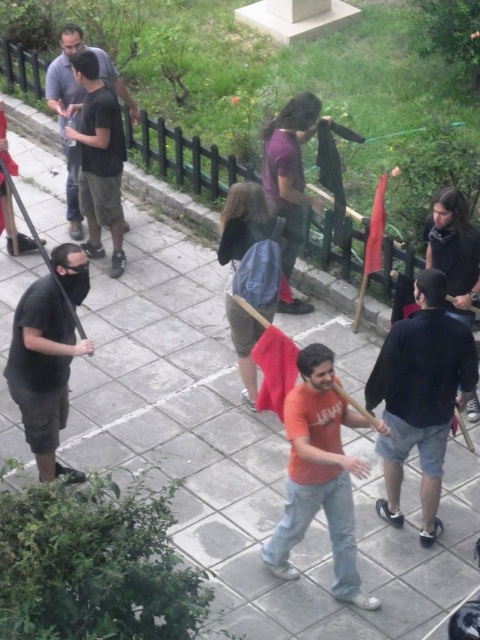
Question: Which of the following is the farthest from the observer?

Choices:
 (A) black matte t-shirt at left
 (B) purple matte shirt at center

Answer: (B)

Question: Is black matte t-shirt at left closer to camera compared to denim shorts at center?

Choices:
 (A) yes
 (B) no

Answer: (A)

Question: Is orange t-shirt at center below denim shorts at center?

Choices:
 (A) yes
 (B) no

Answer: (A)

Question: Estimate the real-world distances between objects in this image. Which object is farther from the dark gray shirt at upper left?

Choices:
 (A) denim shorts at center
 (B) orange t-shirt at center
 (C) purple matte shirt at center
 (D) black matte t-shirt at left

Answer: (B)

Question: Which of the following is the farthest from the observer?

Choices:
 (A) (73, 182)
 (B) (266, 170)

Answer: (A)

Question: Is purple matte shirt at center positioned behind dark gray shirt at upper left?

Choices:
 (A) no
 (B) yes

Answer: (A)